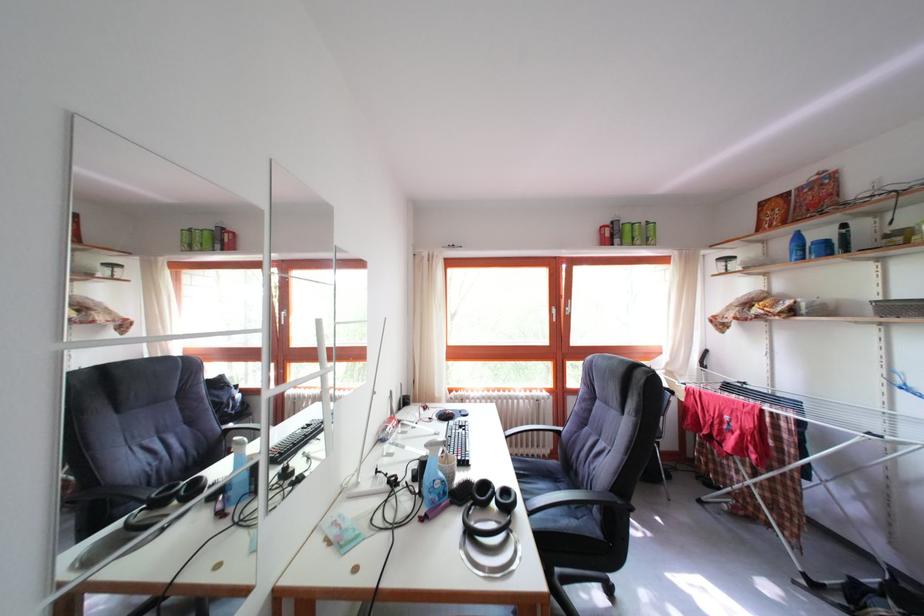
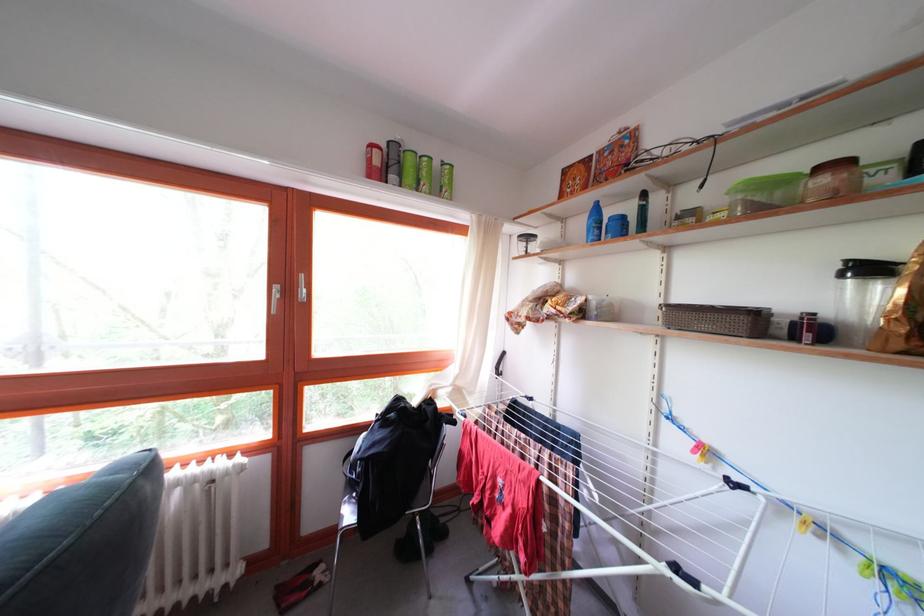
Locate, in the second image, the point that corresponds to (x=641, y=246) in the first image.

(428, 187)